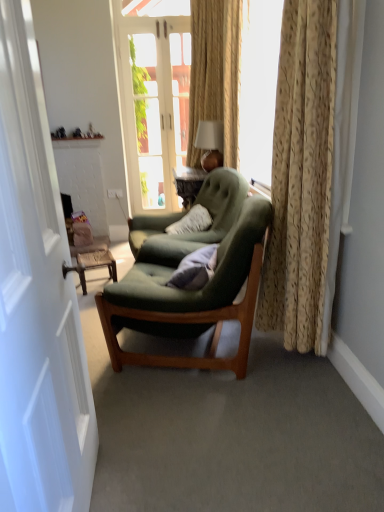
Locate an element on the screen. This screenshot has height=512, width=384. white glass door at center, the first door viewed from the top is located at coordinates (155, 106).

Measure the distance between white glass door at center, the first door viewed from the top, and camera.

white glass door at center, the first door viewed from the top, and camera are 4.14 meters apart from each other.

The width and height of the screenshot is (384, 512). What do you see at coordinates (37, 300) in the screenshot?
I see `white painted wood door at center, positioned as the 1th door in front-to-back order` at bounding box center [37, 300].

This screenshot has width=384, height=512. What do you see at coordinates (184, 215) in the screenshot?
I see `green fabric chair at center, placed as the 1th chair when sorted from back to front` at bounding box center [184, 215].

Find the location of a particular element. matte white table lamp at upper center is located at coordinates (210, 144).

Is velvet blue pillow at center not near matte wood side table at lower left?

No, there isn't a large distance between velvet blue pillow at center and matte wood side table at lower left.

Is velvet blue pillow at center to the right of matte wood side table at lower left from the viewer's perspective?

Indeed, velvet blue pillow at center is positioned on the right side of matte wood side table at lower left.

From a real-world perspective, is velvet blue pillow at center positioned over matte wood side table at lower left based on gravity?

Yes, from a real-world perspective, velvet blue pillow at center is above matte wood side table at lower left.

Consider the image. Which is correct: velvet blue pillow at center is inside matte wood side table at lower left, or outside of it?

velvet blue pillow at center exists outside the volume of matte wood side table at lower left.

Considering the positions of points (298, 219) and (133, 183), is point (298, 219) farther from camera compared to point (133, 183)?

No, (298, 219) is closer to viewer.

Based on the photo, can you confirm if gold textured curtain at right is taller than white glass door at center, the first door viewed from the top?

Incorrect, the height of gold textured curtain at right is not larger of that of white glass door at center, the first door viewed from the top.

Does gold textured curtain at right have a larger size compared to white glass door at center, which is the second door in front-to-back order?

Correct, gold textured curtain at right is larger in size than white glass door at center, which is the second door in front-to-back order.

What's the angular difference between gold textured curtain at right and white glass door at center, acting as the 2th door starting from the bottom,'s facing directions?

They differ by 87.6 degrees in their facing directions.

Are green fabric chair at center, acting as the first chair starting from the front, and white painted wood door at center, which ranks as the first door in bottom-to-top order, making contact?

They are not placed beside each other.

From a real-world perspective, is green fabric chair at center, arranged as the 2th chair when viewed from the back, above or below white painted wood door at center, which ranks as the 2th door in top-to-bottom order?

Clearly, from a real-world perspective, green fabric chair at center, arranged as the 2th chair when viewed from the back, is below white painted wood door at center, which ranks as the 2th door in top-to-bottom order.

Would you say white painted wood door at center, which ranks as the first door in bottom-to-top order, is part of green fabric chair at center, arranged as the 2th chair when viewed from the back,'s contents?

Actually, white painted wood door at center, which ranks as the first door in bottom-to-top order, is outside green fabric chair at center, arranged as the 2th chair when viewed from the back.

How many degrees apart are the facing directions of green fabric chair at center, arranged as the 2th chair when viewed from the back, and white painted wood door at center, which is the second door from back to front?

green fabric chair at center, arranged as the 2th chair when viewed from the back, and white painted wood door at center, which is the second door from back to front, are facing 164 degrees away from each other.

Is point (94, 266) positioned before point (296, 25)?

No, (94, 266) is further to viewer.

Who is bigger, matte wood side table at lower left or gold textured curtain at right?

gold textured curtain at right is bigger.

Is matte wood side table at lower left facing away from gold textured curtain at right?

No, matte wood side table at lower left is not facing the opposite direction of gold textured curtain at right.

How far apart are matte wood side table at lower left and gold textured curtain at right?

matte wood side table at lower left is 4.71 feet from gold textured curtain at right.

Would you say green fabric chair at center, which is the second chair from front to back, is to the left or to the right of green fabric chair at center, arranged as the 2th chair when viewed from the back, in the picture?

From the image, it's evident that green fabric chair at center, which is the second chair from front to back, is to the left of green fabric chair at center, arranged as the 2th chair when viewed from the back.

Does point (159, 227) appear closer or farther from the camera than point (259, 232)?

Clearly, point (159, 227) is more distant from the camera than point (259, 232).

Image resolution: width=384 pixels, height=512 pixels. Identify the location of chair below the green fabric chair at center, which is the second chair from front to back (from a real-world perspective). (191, 298).

Would you say green fabric chair at center, which is the second chair from front to back, contains green fabric chair at center, acting as the first chair starting from the front?

No, green fabric chair at center, acting as the first chair starting from the front, is located outside of green fabric chair at center, which is the second chair from front to back.

Is the position of green fabric chair at center, acting as the first chair starting from the front, less distant than that of white glass door at center, the first door viewed from the top?

Yes, green fabric chair at center, acting as the first chair starting from the front, is in front of white glass door at center, the first door viewed from the top.

What's the angular difference between green fabric chair at center, arranged as the 2th chair when viewed from the back, and white glass door at center, which is the first door in back-to-front order,'s facing directions?

There is a 105-degree angle between the facing directions of green fabric chair at center, arranged as the 2th chair when viewed from the back, and white glass door at center, which is the first door in back-to-front order.

Is green fabric chair at center, acting as the first chair starting from the front, oriented towards white glass door at center, acting as the 2th door starting from the bottom?

No.

In the scene shown: Who is shorter, green fabric chair at center, acting as the first chair starting from the front, or white glass door at center, the first door viewed from the top?

green fabric chair at center, acting as the first chair starting from the front, is shorter.

Does gold textured curtain at right have a lesser width compared to velvet blue pillow at center?

No, gold textured curtain at right is not thinner than velvet blue pillow at center.

Is gold textured curtain at right next to velvet blue pillow at center?

No, gold textured curtain at right is not touching velvet blue pillow at center.

Is point (288, 117) closer to viewer compared to point (177, 272)?

Yes, point (288, 117) is closer to viewer.

The image size is (384, 512). Identify the location of curtain that appears in front of the velvet blue pillow at center. (301, 176).

At what (x,y) coordinates should I click in order to perform the action: click on pillow above the matte wood side table at lower left (from the image's perspective). Please return your answer as a coordinate pair (x, y). This screenshot has width=384, height=512. Looking at the image, I should click on (195, 269).

There is a gold textured curtain at right. Where is `door above it (from a real-world perspective)`? door above it (from a real-world perspective) is located at coordinates (155, 106).

When comparing their distances from green fabric chair at center, arranged as the 2th chair when viewed from the back, does matte white table lamp at upper center or velvet blue pillow at center seem further?

The object further to green fabric chair at center, arranged as the 2th chair when viewed from the back, is matte white table lamp at upper center.

From the image, which object appears to be farther from white glass door at center, which is the second door in front-to-back order, green fabric chair at center, acting as the first chair starting from the front, or green fabric chair at center, placed as the 1th chair when sorted from back to front?

The object further to white glass door at center, which is the second door in front-to-back order, is green fabric chair at center, acting as the first chair starting from the front.

Consider the image. Estimate the real-world distances between objects in this image. Which object is closer to matte white table lamp at upper center, gold textured curtain at right or matte wood side table at lower left?

The object closer to matte white table lamp at upper center is matte wood side table at lower left.

When comparing their distances from velvet blue pillow at center, does green fabric chair at center, arranged as the 2th chair when viewed from the back, or matte wood side table at lower left seem further?

Based on the image, matte wood side table at lower left appears to be further to velvet blue pillow at center.

When comparing their distances from gold textured curtain at right, does white painted wood door at center, which ranks as the first door in bottom-to-top order, or matte white table lamp at upper center seem closer?

white painted wood door at center, which ranks as the first door in bottom-to-top order.

Looking at the image, which one is located further to white glass door at center, acting as the 2th door starting from the bottom, matte wood side table at lower left or green fabric chair at center, acting as the first chair starting from the front?

Among the two, green fabric chair at center, acting as the first chair starting from the front, is located further to white glass door at center, acting as the 2th door starting from the bottom.

When comparing their distances from matte white table lamp at upper center, does matte wood side table at lower left or velvet blue pillow at center seem closer?

Based on the image, matte wood side table at lower left appears to be nearer to matte white table lamp at upper center.

From the image, which object appears to be farther from green fabric chair at center, acting as the first chair starting from the front, white glass door at center, which is the second door in front-to-back order, or white painted wood door at center, which ranks as the first door in bottom-to-top order?

Based on the image, white glass door at center, which is the second door in front-to-back order, appears to be further to green fabric chair at center, acting as the first chair starting from the front.

Locate an element on the screen. pillow between white painted wood door at center, which ranks as the first door in bottom-to-top order, and green fabric chair at center, placed as the 1th chair when sorted from back to front, along the z-axis is located at coordinates (195, 269).

Image resolution: width=384 pixels, height=512 pixels. Find the location of `table lamp between green fabric chair at center, which is the second chair from front to back, and white glass door at center, which is the first door in back-to-front order, from front to back`. table lamp between green fabric chair at center, which is the second chair from front to back, and white glass door at center, which is the first door in back-to-front order, from front to back is located at coordinates (210, 144).

Identify the location of table lamp between green fabric chair at center, acting as the first chair starting from the front, and white glass door at center, which is the first door in back-to-front order, from front to back. The image size is (384, 512). (210, 144).

Image resolution: width=384 pixels, height=512 pixels. Identify the location of side table between white painted wood door at center, positioned as the 1th door in front-to-back order, and white glass door at center, the first door viewed from the top, from front to back. (95, 265).